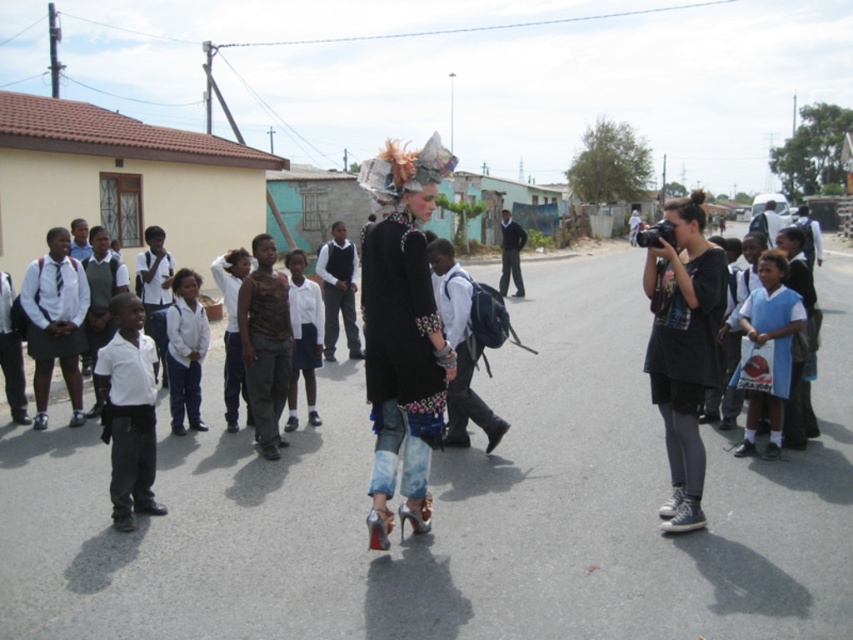
Question: Is the position of fuzzy fabric headdress at center less distant than that of blue fabric shirt at right?

Choices:
 (A) yes
 (B) no

Answer: (A)

Question: Does white cotton shirt at left have a greater width compared to white uniform at center?

Choices:
 (A) no
 (B) yes

Answer: (B)

Question: Which point is closer to the camera?

Choices:
 (A) (770, 218)
 (B) (386, 253)
 (C) (115, 358)
 (D) (502, 296)

Answer: (B)

Question: Which point is farther to the camera?

Choices:
 (A) click(747, 228)
 (B) click(325, 337)
 (C) click(782, 369)
 (D) click(425, 208)

Answer: (A)

Question: Which of the following is the farthest from the observer?

Choices:
 (A) (178, 355)
 (B) (509, 250)

Answer: (B)

Question: Is fuzzy fabric headdress at center to the left of blue fabric shirt at right from the viewer's perspective?

Choices:
 (A) yes
 (B) no

Answer: (A)